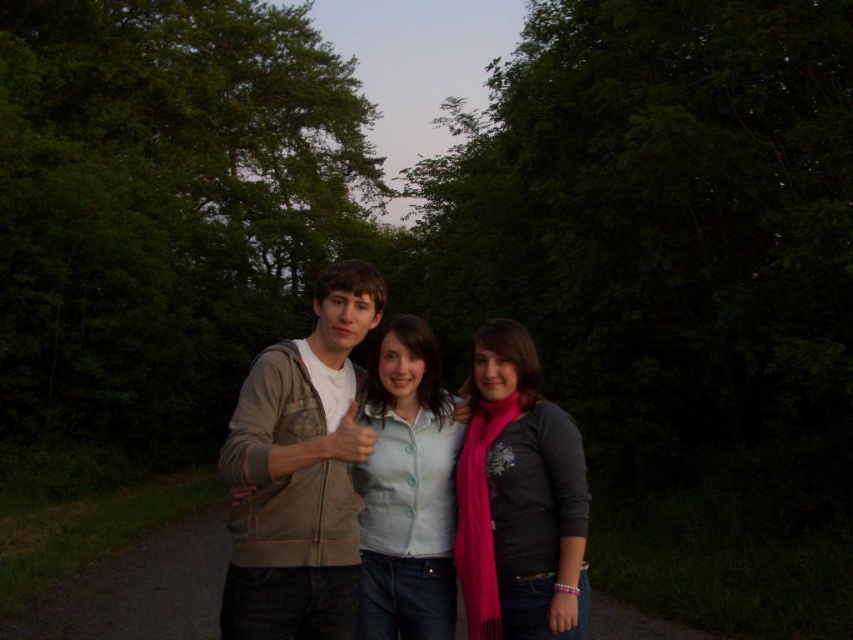
Can you confirm if matte beige hoodie at center is shorter than light blue button-up shirt at center?

Incorrect, matte beige hoodie at center's height does not fall short of light blue button-up shirt at center's.

This screenshot has width=853, height=640. What do you see at coordinates (300, 472) in the screenshot?
I see `matte beige hoodie at center` at bounding box center [300, 472].

Where is `matte beige hoodie at center`? matte beige hoodie at center is located at coordinates (300, 472).

Is matte beige hoodie at center wider than khaki cotton hoodie at center?

Correct, the width of matte beige hoodie at center exceeds that of khaki cotton hoodie at center.

Can you confirm if matte beige hoodie at center is taller than khaki cotton hoodie at center?

Indeed, matte beige hoodie at center has a greater height compared to khaki cotton hoodie at center.

At what (x,y) coordinates should I click in order to perform the action: click on matte beige hoodie at center. Please return your answer as a coordinate pair (x, y). This screenshot has height=640, width=853. Looking at the image, I should click on (300, 472).

Identify the location of matte beige hoodie at center. The height and width of the screenshot is (640, 853). (300, 472).

Is matte pink scarf at center smaller than light blue button-up shirt at center?

Indeed, matte pink scarf at center has a smaller size compared to light blue button-up shirt at center.

Is point (560, 481) farther from viewer compared to point (451, 506)?

No, it is in front of (451, 506).

I want to click on matte pink scarf at center, so click(518, 499).

The image size is (853, 640). I want to click on matte pink scarf at center, so tap(518, 499).